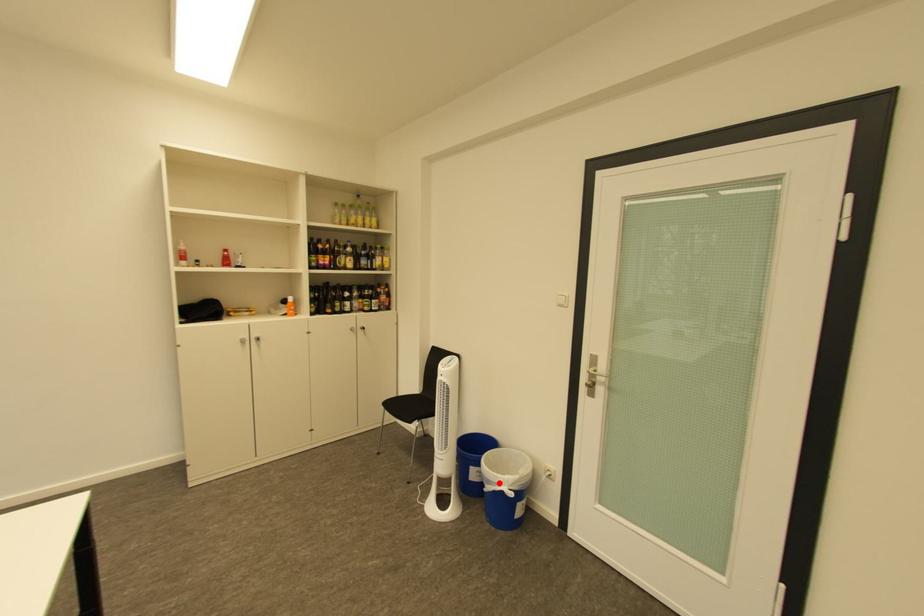
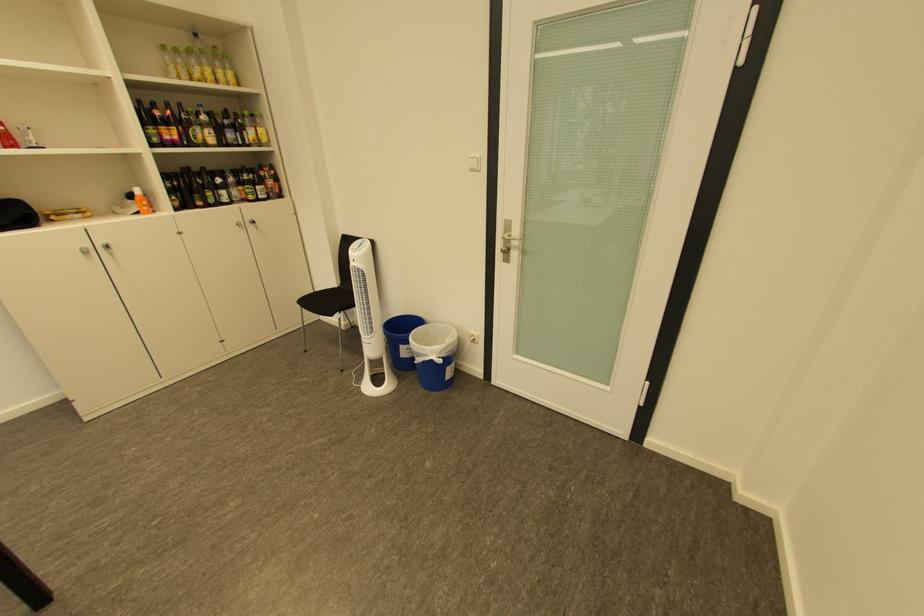
Where in the second image is the point corresponding to the highlighted location from the first image?

(429, 355)